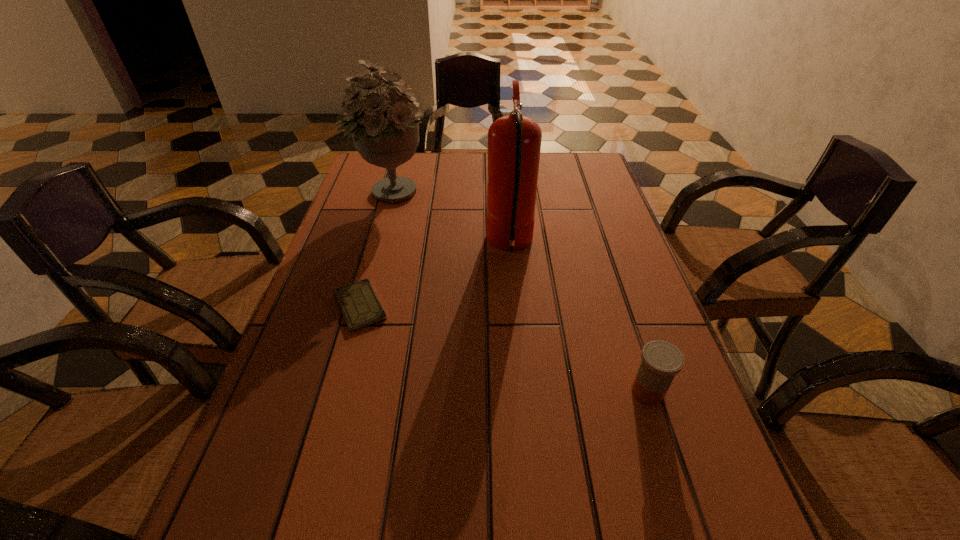
Find the location of a particular element. The width and height of the screenshot is (960, 540). free location located on the right of the bouquet is located at coordinates (460, 194).

Where is `vacant area situated 0.240m on the label of the nearest object`? This screenshot has height=540, width=960. vacant area situated 0.240m on the label of the nearest object is located at coordinates (498, 393).

Locate an element on the screen. blank space located 0.320m on the label of the nearest object is located at coordinates (455, 393).

The height and width of the screenshot is (540, 960). Identify the location of vacant region located on the label of the nearest object. (542, 393).

At what (x,y) coordinates should I click in order to perform the action: click on free space located on the back of the shortest object. Please return your answer as a coordinate pair (x, y). The width and height of the screenshot is (960, 540). Looking at the image, I should click on tap(374, 255).

Identify the location of object that is at the far edge. (386, 134).

This screenshot has height=540, width=960. I want to click on bouquet situated at the left edge, so click(x=386, y=134).

Locate an element on the screen. checkbook positioned at the left edge is located at coordinates (360, 306).

You are a GUI agent. You are given a task and a screenshot of the screen. Output one action in this format:
    pyautogui.click(x=<x>, y=<y>)
    Task: Click on the object that is at the right edge
    
    Given the screenshot: What is the action you would take?
    pyautogui.click(x=661, y=361)

I want to click on object that is at the far left corner, so click(386, 134).